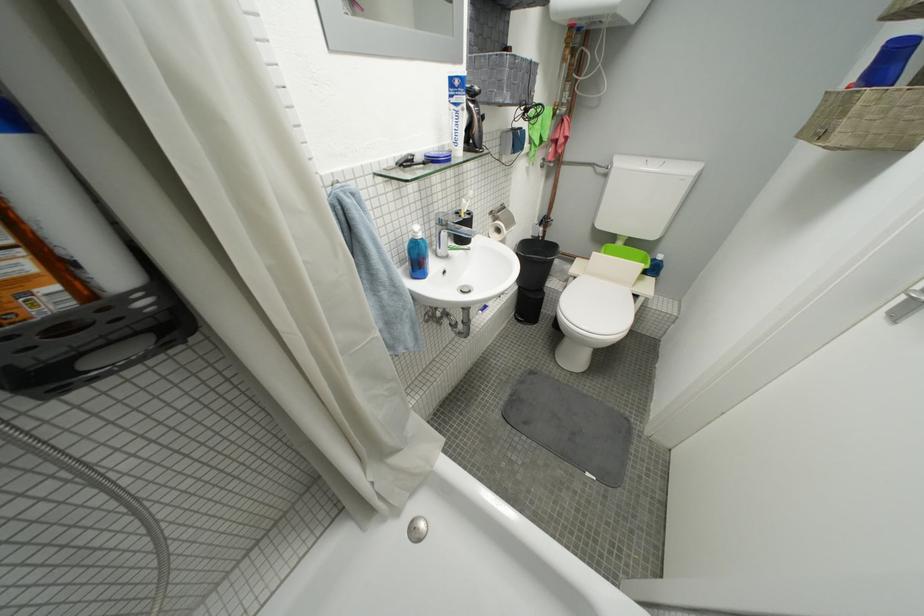
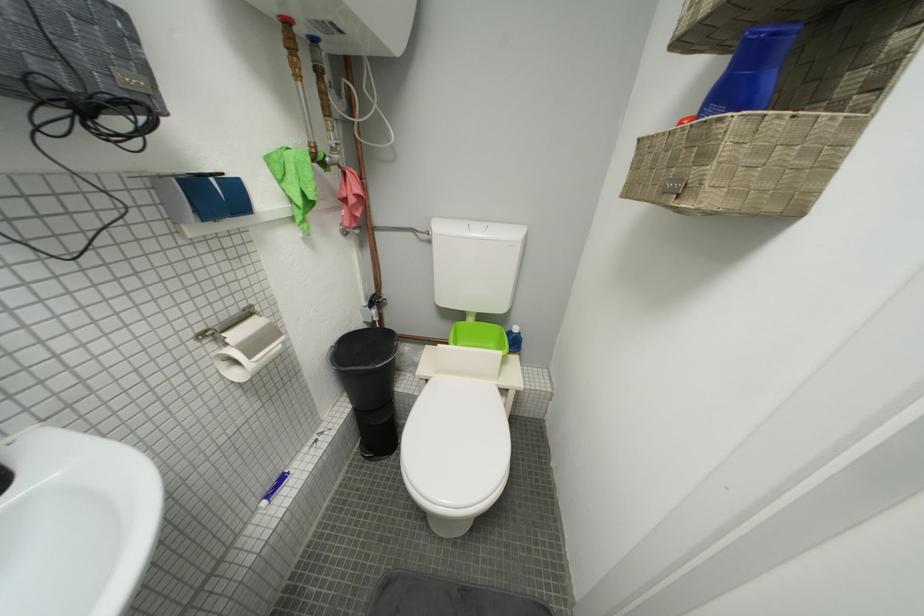
The images are taken continuously from a first-person perspective. In which direction are you moving?

The cameraman moved toward right, forward.